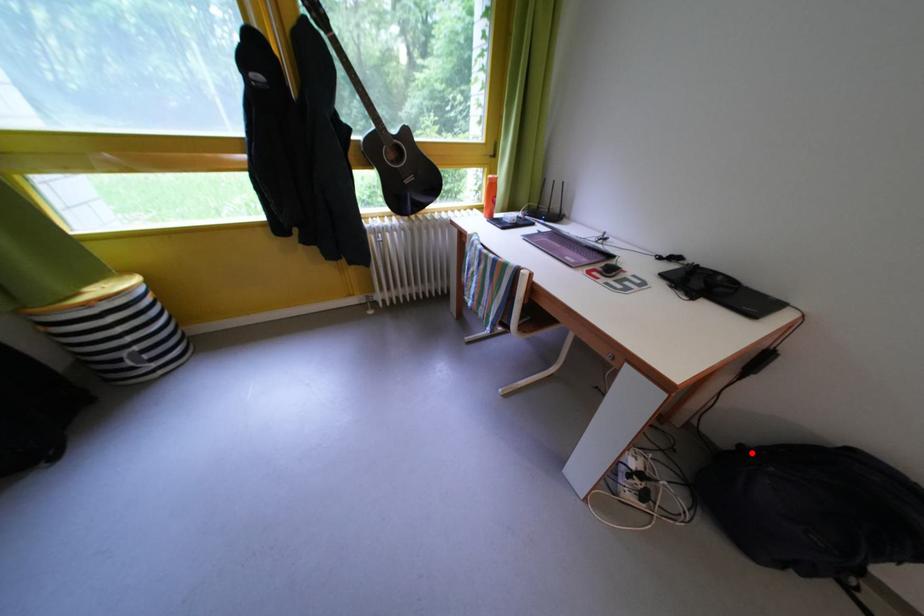
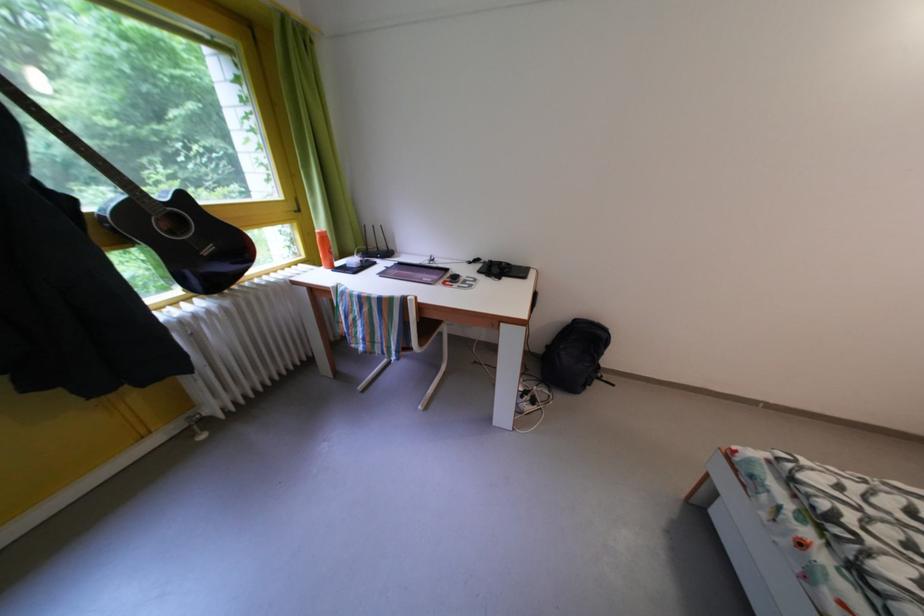
Question: I am providing you with two images of the same scene from different viewpoints. Given a red point in image1, look at the same physical point in image2. Is it:

Choices:
 (A) Closer to the viewpoint
 (B) Farther from the viewpoint

Answer: (A)